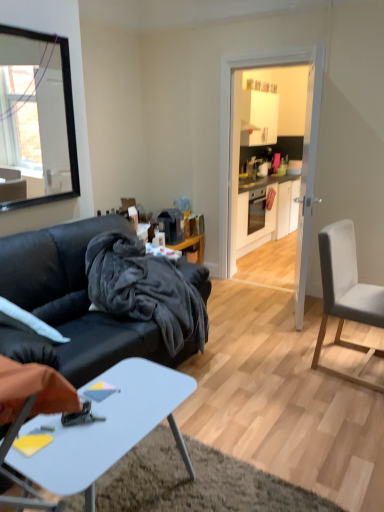
Question: From the image's perspective, is white glossy cabinet at center located above or below white plastic desk at lower center?

Choices:
 (A) below
 (B) above

Answer: (B)

Question: Is white glossy cabinet at center wider or thinner than white plastic desk at lower center?

Choices:
 (A) thin
 (B) wide

Answer: (B)

Question: Based on their relative distances, which object is nearer to the light gray fabric chair at right?

Choices:
 (A) white plastic desk at lower center
 (B) velvet dark gray couch at left
 (C) white glossy cabinet at upper center
 (D) black fuzzy blanket at center
 (E) white glossy cabinet at center

Answer: (D)

Question: Which of these objects is positioned farthest from the black fuzzy blanket at center?

Choices:
 (A) white plastic desk at lower center
 (B) light gray fabric chair at right
 (C) velvet dark gray couch at left
 (D) white glossy door at center
 (E) white glossy cabinet at upper center

Answer: (E)